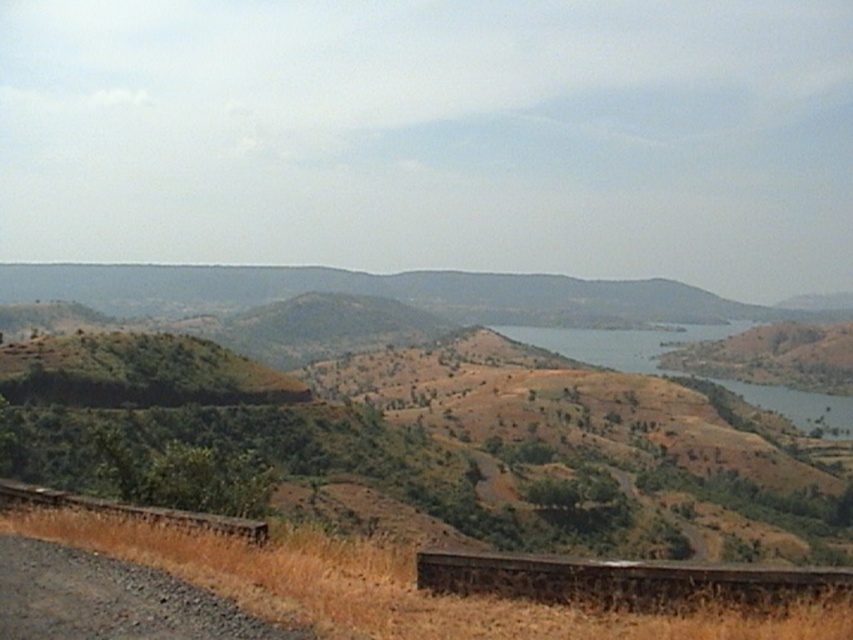
You are standing at the camera position in the image. There is a point at coordinates point (x=135, y=588). Can you reach that point by walking straight ahead without deviating from your current path?

The point at coordinates point (x=135, y=588) is 10.62 meters away from the camera. Since there is a body of water in the midground stretching across the scene, it is likely blocking the path. Therefore, you cannot reach that point by walking straight ahead without deviating from your current path.